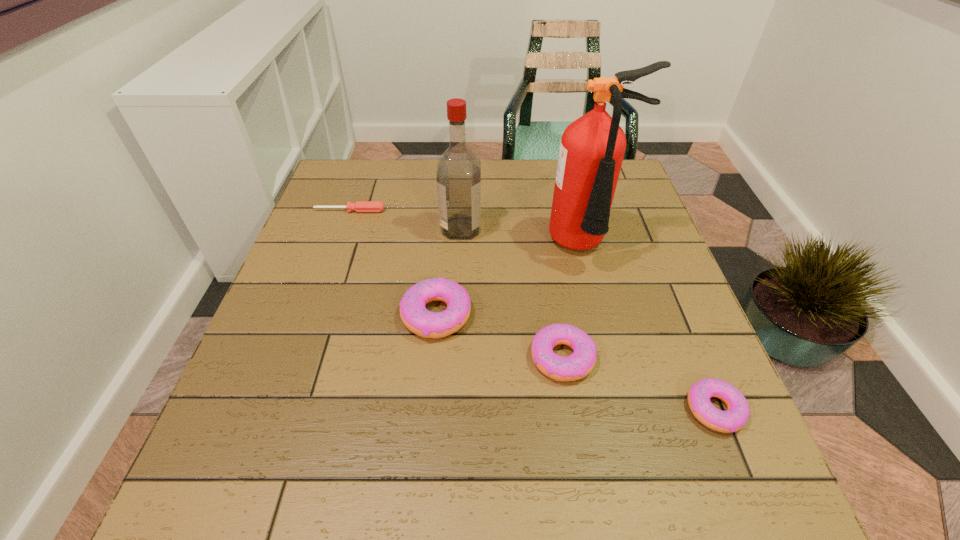
What are the coordinates of `vacant area in the image that satisfies the following two spatial constraints: 1. on the front-facing side of the second shortest doughnut; 2. on the right side of the fifth shortest object` in the screenshot? It's located at (455, 358).